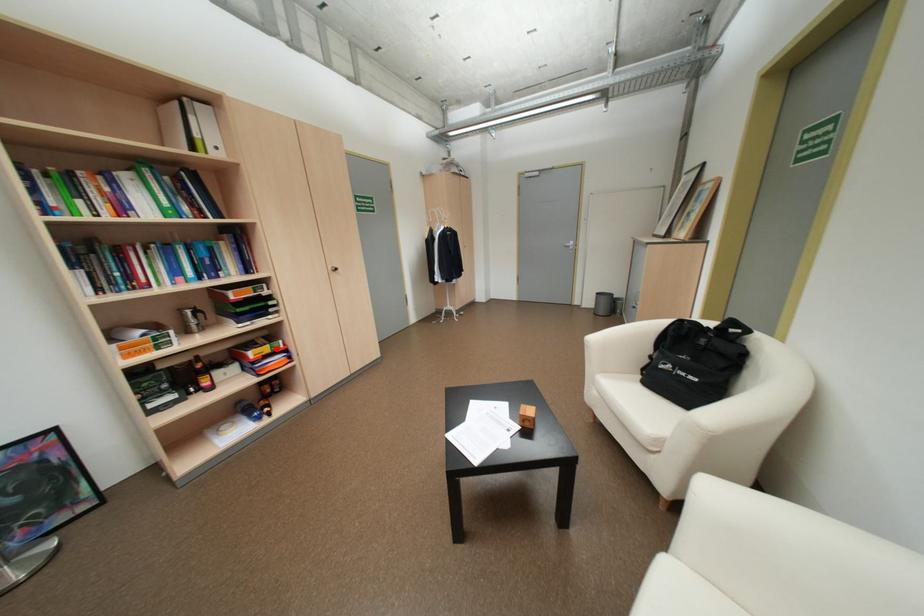
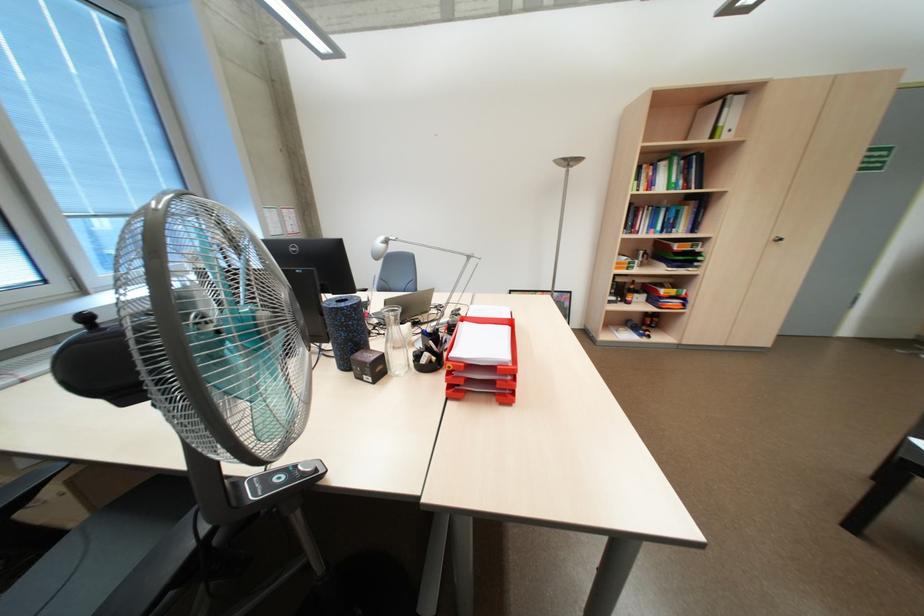
In the second image, find the point that corresponds to the highlighted location in the first image.

(683, 291)